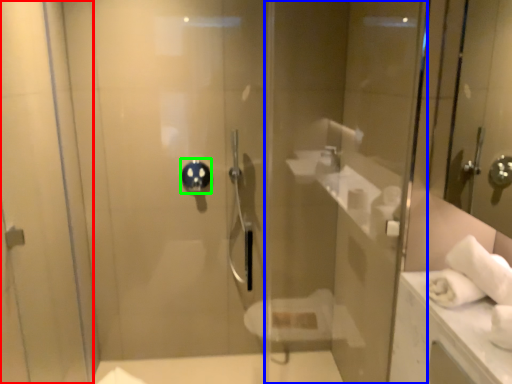
Question: Which is nearer to the screen door (highlighted by a red box)? glass door (highlighted by a blue box) or shower (highlighted by a green box).

Choices:
 (A) glass door
 (B) shower

Answer: (B)